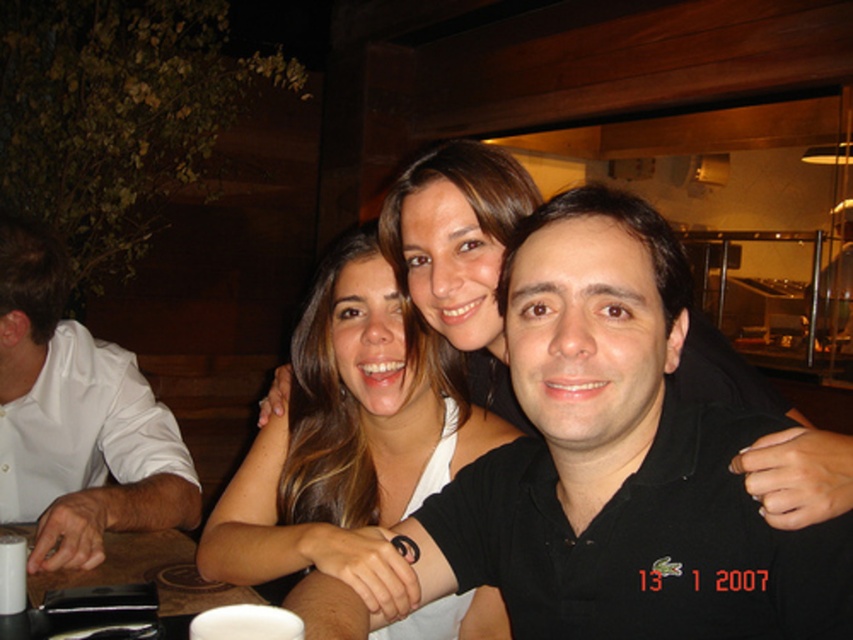
Between point (563, 593) and point (9, 419), which one is positioned behind?

The point (9, 419) is behind.

Is black matte shirt at center above white glossy cup at left?

No.

I want to click on black matte shirt at center, so click(619, 461).

Can you confirm if white glossy cup at left is positioned to the left of white matte cup at lower center?

Yes, white glossy cup at left is to the left of white matte cup at lower center.

Measure the distance between point (122,502) and camera.

Point (122,502) is 1.31 meters from camera.

Locate an element on the screen. This screenshot has width=853, height=640. white glossy cup at left is located at coordinates (76, 419).

Based on the photo, which is above, smooth white tank top at center or white matte cup at lower center?

smooth white tank top at center is above.

Which is in front, point (361, 513) or point (219, 618)?

Positioned in front is point (219, 618).

I want to click on smooth white tank top at center, so click(x=347, y=440).